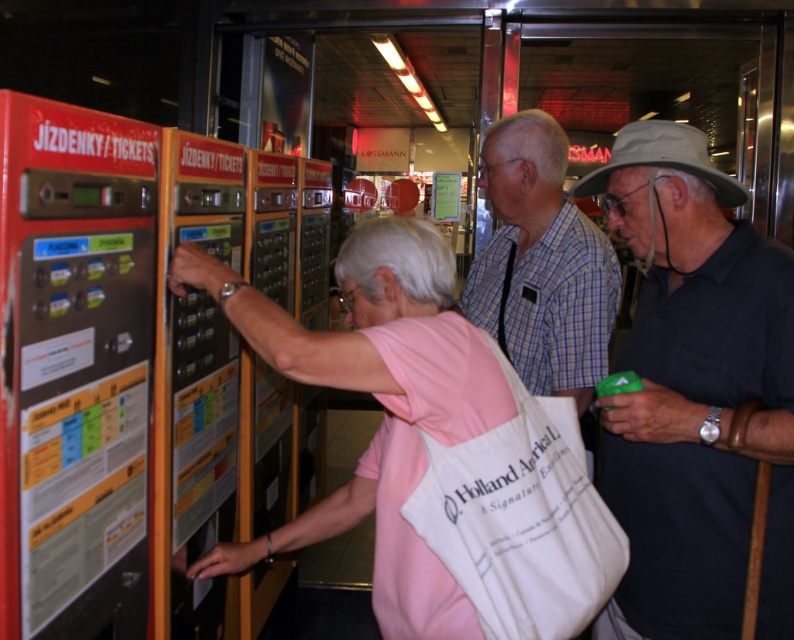
Question: Which point is closer to the camera taking this photo?

Choices:
 (A) (725, 392)
 (B) (387, 472)
 (C) (538, 280)

Answer: (B)

Question: Which point is closer to the camera?

Choices:
 (A) black fabric hat at upper right
 (B) plaid cotton shirt at center

Answer: (A)

Question: Is black fabric hat at upper right below plaid cotton shirt at center?

Choices:
 (A) no
 (B) yes

Answer: (B)

Question: Is pink fabric bag at center further to camera compared to plaid cotton shirt at center?

Choices:
 (A) yes
 (B) no

Answer: (B)

Question: Can you confirm if pink fabric bag at center is thinner than plaid cotton shirt at center?

Choices:
 (A) no
 (B) yes

Answer: (A)

Question: Which object is farther from the camera taking this photo?

Choices:
 (A) pink fabric bag at center
 (B) black fabric hat at upper right

Answer: (B)